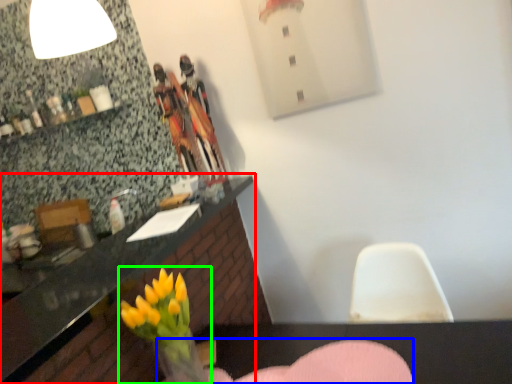
Question: Which is farther away from countertop (highlighted by a red box)? armchair (highlighted by a blue box) or floral arrangement (highlighted by a green box)?

Choices:
 (A) armchair
 (B) floral arrangement

Answer: (A)